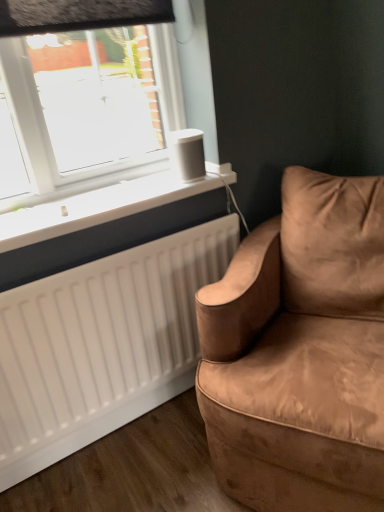
Locate an element on the screen. Image resolution: width=384 pixels, height=512 pixels. blank space above white matte radiator at lower left (from a real-world perspective) is located at coordinates (99, 191).